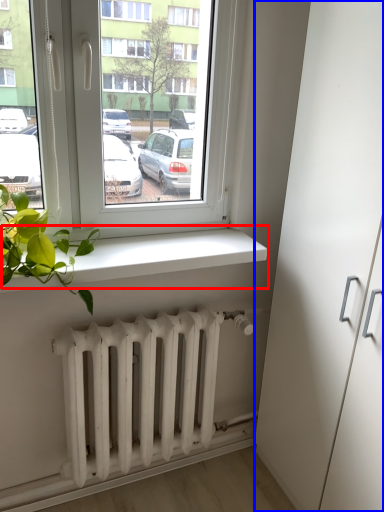
Question: Which point is further to the camera, window sill (highlighted by a red box) or glass door (highlighted by a blue box)?

Choices:
 (A) window sill
 (B) glass door

Answer: (A)